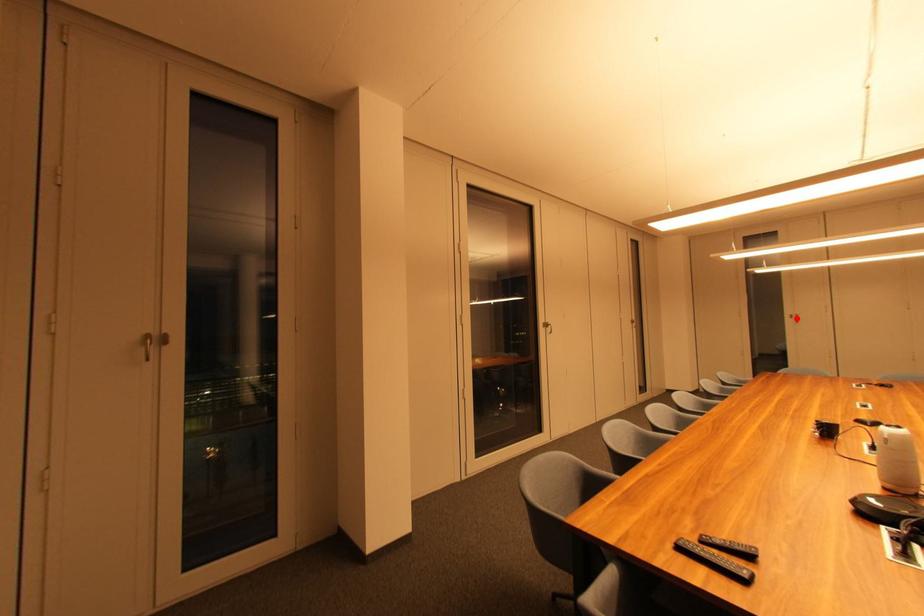
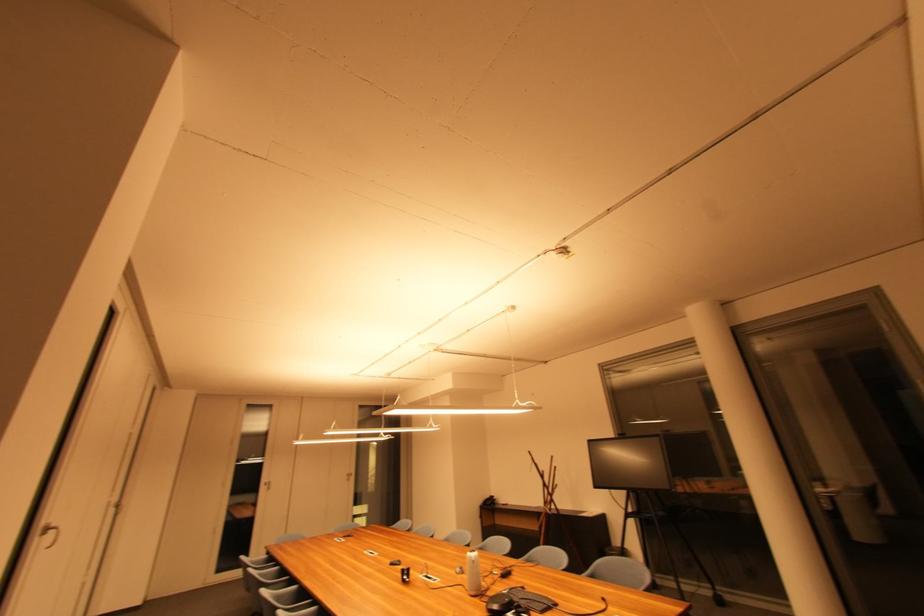
In the second image, find the point that corresponds to the highlighted location in the first image.

(271, 485)